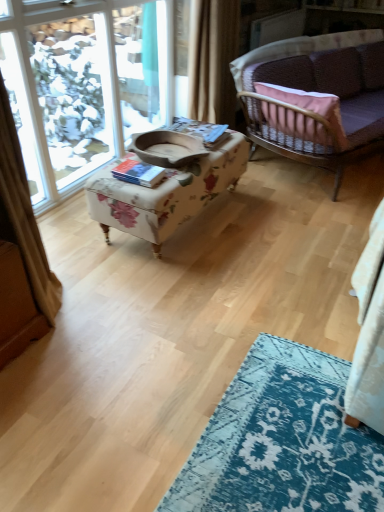
What are the coordinates of `free location in front of floral fabric ottoman at center` in the screenshot? It's located at (190, 291).